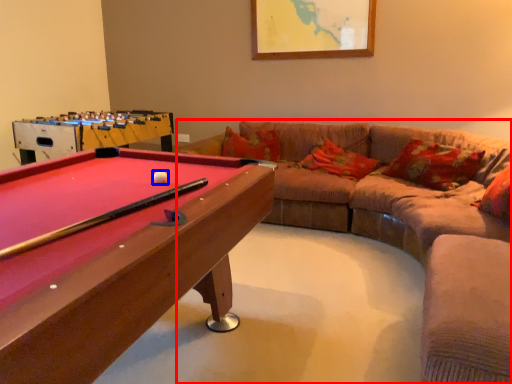
Question: Which of the following is the farthest to the observer, studio couch (highlighted by a red box) or ball (highlighted by a blue box)?

Choices:
 (A) studio couch
 (B) ball

Answer: (A)